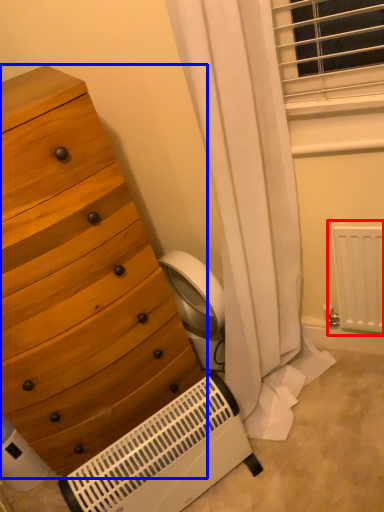
Question: Which object appears closest to the camera in this image, radiator (highlighted by a red box) or chest of drawers (highlighted by a blue box)?

Choices:
 (A) radiator
 (B) chest of drawers

Answer: (B)